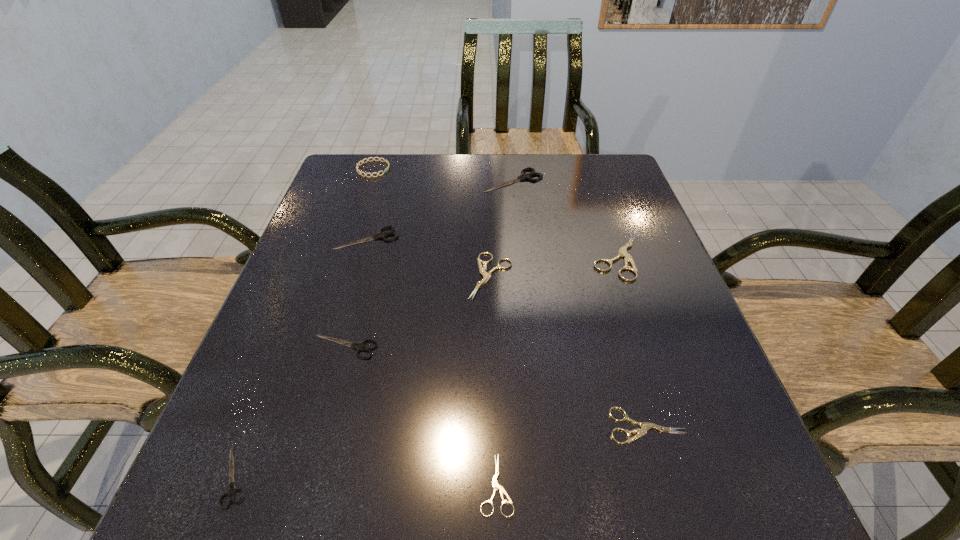
Where is `beige shears that is the second closest one to the farthest black shears`? The width and height of the screenshot is (960, 540). beige shears that is the second closest one to the farthest black shears is located at coordinates (486, 276).

Identify which beige shears is the fourth nearest to the blue bracelet. Please provide its 2D coordinates. Your answer should be formatted as a tuple, i.e. [(x, y)], where the tuple contains the x and y coordinates of a point satisfying the conditions above.

[(645, 426)]

The image size is (960, 540). In order to click on vacant region that satisfies the following two spatial constraints: 1. on the back side of the biggest beige shears; 2. on the left side of the second smallest black shears in this screenshot , I will do `click(370, 255)`.

At what (x,y) coordinates should I click in order to perform the action: click on vacant position in the image that satisfies the following two spatial constraints: 1. on the surface of the tallest object showing star-shaped elements; 2. on the right side of the second biggest black shears. Please return your answer as a coordinate pair (x, y). Looking at the image, I should click on (350, 238).

Locate an element on the screen. The width and height of the screenshot is (960, 540). free spot that satisfies the following two spatial constraints: 1. on the back side of the second farthest black shears; 2. on the surface of the bracelet showing star-shaped elements is located at coordinates (388, 169).